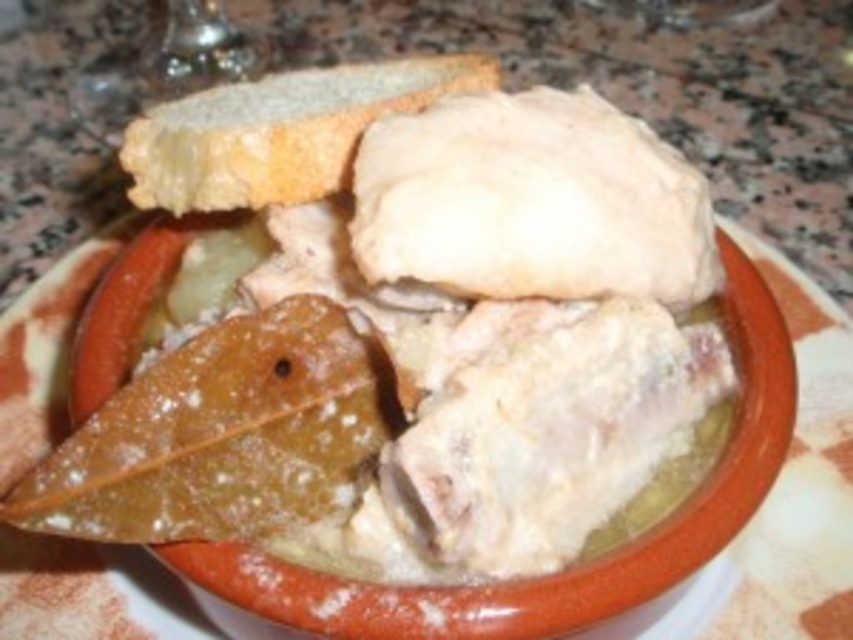
Question: Which of the following is the closest to the observer?

Choices:
 (A) (585, 124)
 (B) (337, 164)

Answer: (A)

Question: Is white matte leaf at upper left positioned in front of spongy white bread at upper center?

Choices:
 (A) yes
 (B) no

Answer: (A)

Question: Among these points, which one is farthest from the camera?

Choices:
 (A) (299, 160)
 (B) (547, 291)

Answer: (A)

Question: Is white matte leaf at upper left bigger than spongy white bread at upper center?

Choices:
 (A) no
 (B) yes

Answer: (B)

Question: Where is white matte leaf at upper left located in relation to spongy white bread at upper center in the image?

Choices:
 (A) left
 (B) right

Answer: (B)

Question: Among these points, which one is nearest to the camera?

Choices:
 (A) (320, 244)
 (B) (132, 122)

Answer: (A)